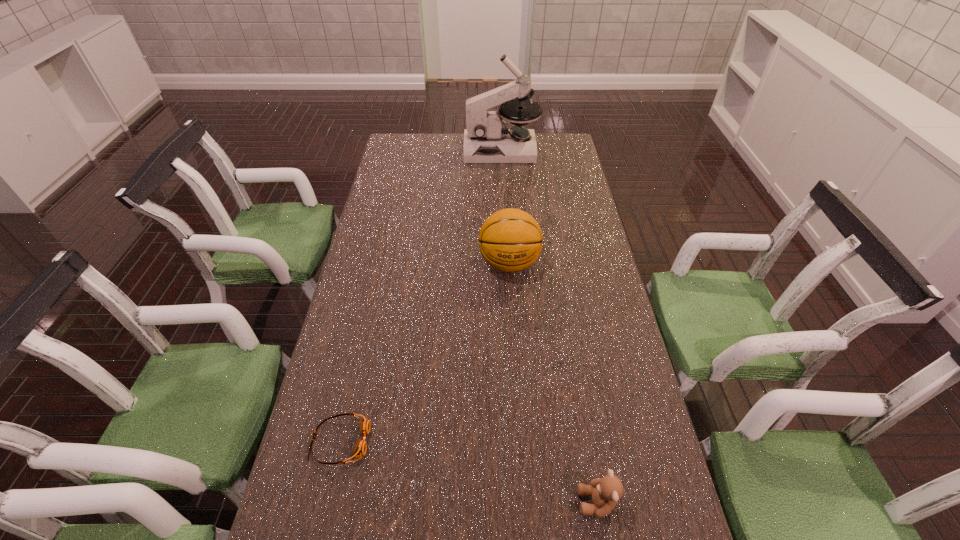
The height and width of the screenshot is (540, 960). I want to click on object at the far right corner, so click(487, 139).

The height and width of the screenshot is (540, 960). Find the location of `free point at the far edge`. free point at the far edge is located at coordinates (454, 157).

This screenshot has height=540, width=960. I want to click on vacant space at the left edge of the desktop, so coord(350,462).

What are the coordinates of `vacant space at the right edge of the desktop` in the screenshot? It's located at (570, 234).

In the image, there is a desktop. At what (x,y) coordinates should I click in order to perform the action: click on free space at the far left corner. Please return your answer as a coordinate pair (x, y). Looking at the image, I should click on (394, 144).

Where is `free spot between the leftmost object and the farthest object`? Image resolution: width=960 pixels, height=540 pixels. free spot between the leftmost object and the farthest object is located at coordinates (420, 295).

Locate an element on the screen. Image resolution: width=960 pixels, height=540 pixels. free space between the tallest object and the basketball is located at coordinates (505, 207).

Identify the location of free space between the third nearest object and the leftmost object. (424, 353).

I want to click on vacant region between the teddy bear and the shortest object, so click(x=468, y=471).

What are the coordinates of `free area in between the tallest object and the leftmost object` in the screenshot? It's located at (420, 295).